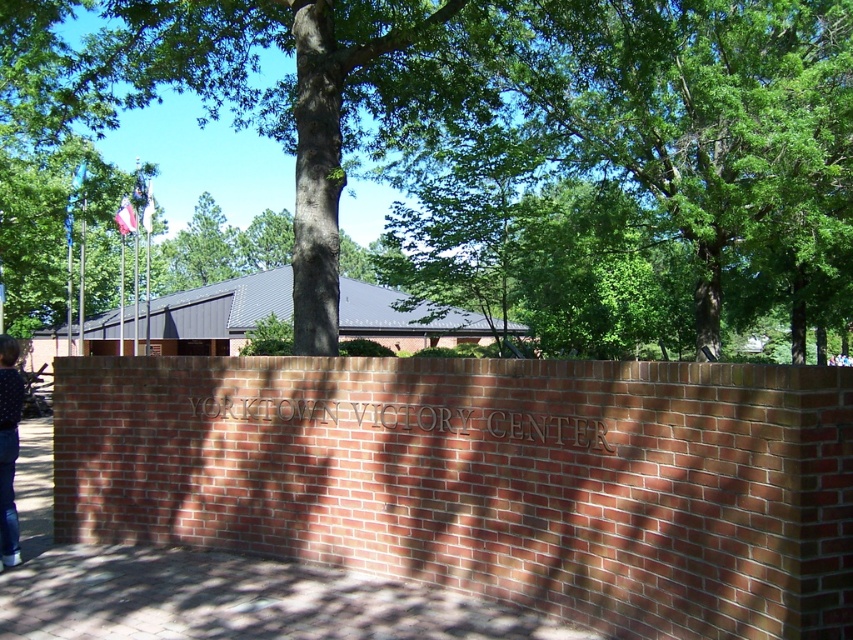
You are standing at the entrance of the Yorktown Victory Center and want to take a photo of the engraved brick wall with the green leafy tree at center in the background. If your camera can focus on objects up to 8 meters away, will the tree be in focus?

The green leafy tree at center is 7.84 meters away from the camera, which is within the camera focus range of up to 8 meters. Therefore, the tree will be in focus.

You are a visitor at the Yorktown Victory Center and want to take a photo of the engraved brick wall with the flags in the background. You notice the green leafy tree at center and the blue denim jeans at lower left in your viewfinder. Which object should you position to the left side of your photo to ensure the flags are visible behind the tree?

You should position the blue denim jeans at lower left on the left side of your photo. Since the green leafy tree at center is to the right of the blue denim jeans at lower left, placing the jeans on the left will keep the tree centered, allowing the flags on the left of the building in the background to be visible behind the tree.

In the scene shown: You are a visitor at the Yorktown Victory Center and you see a green leafy tree at center and blue denim jeans at lower left. Which object is taller?

The green leafy tree at center is taller than the blue denim jeans at lower left.